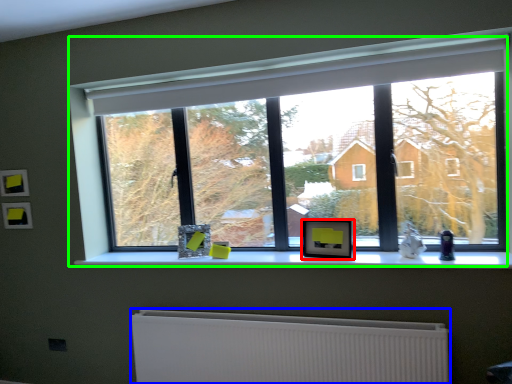
Question: Based on their relative distances, which object is nearer to picture frame (highlighted by a red box)? Choose from radiator (highlighted by a blue box) and window (highlighted by a green box).

Choices:
 (A) radiator
 (B) window

Answer: (A)